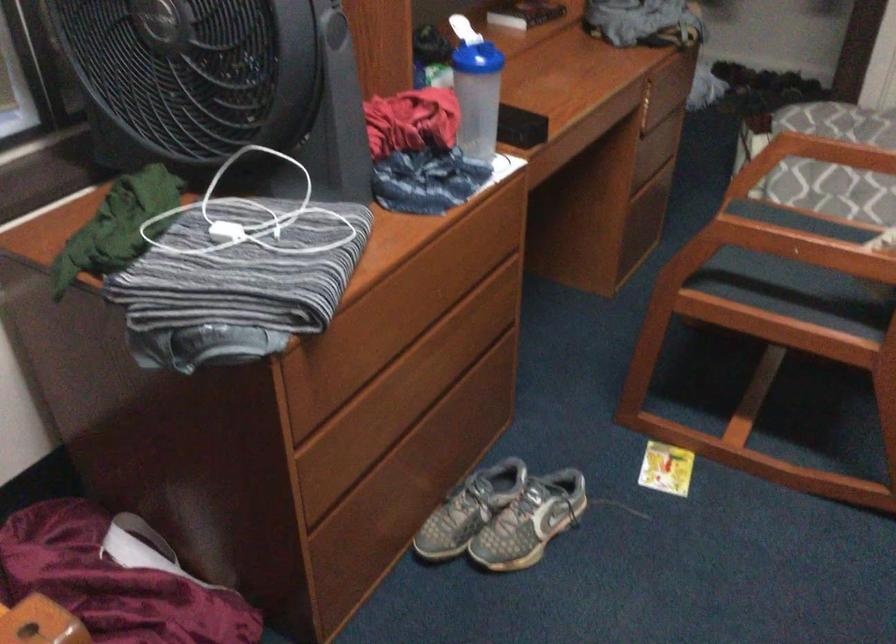
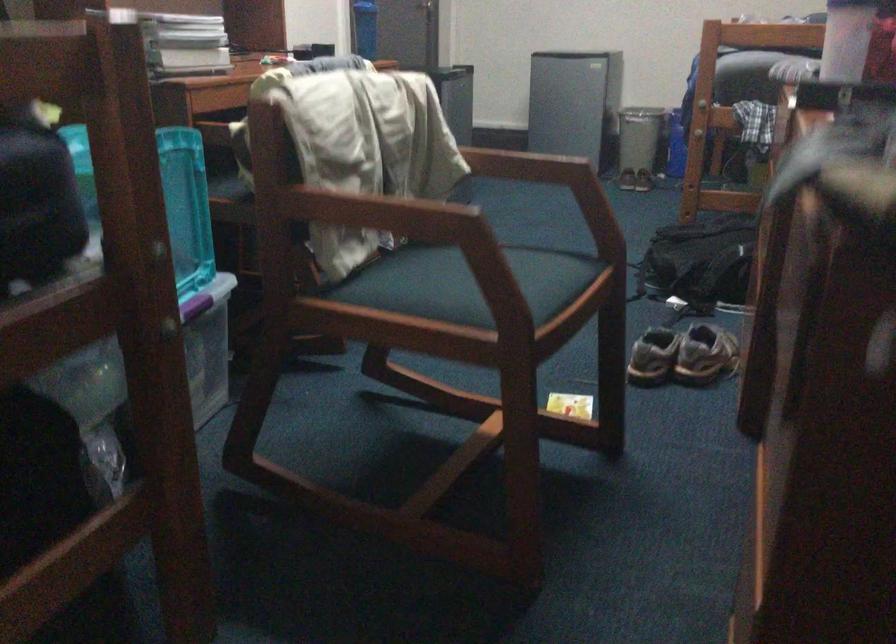
In the second image, find the point that corresponds to (537,468) in the first image.

(682, 355)